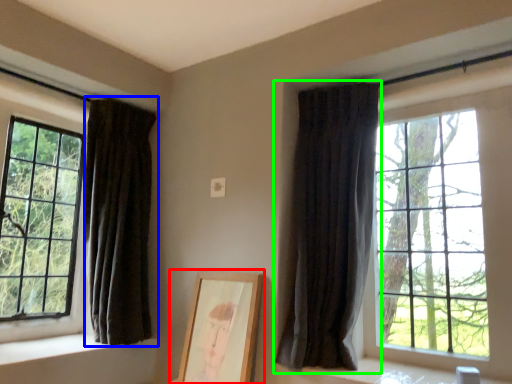
Question: Based on their relative distances, which object is nearer to picture frame (highlighted by a red box)? Choose from curtain (highlighted by a blue box) and curtain (highlighted by a green box).

Choices:
 (A) curtain
 (B) curtain

Answer: (B)